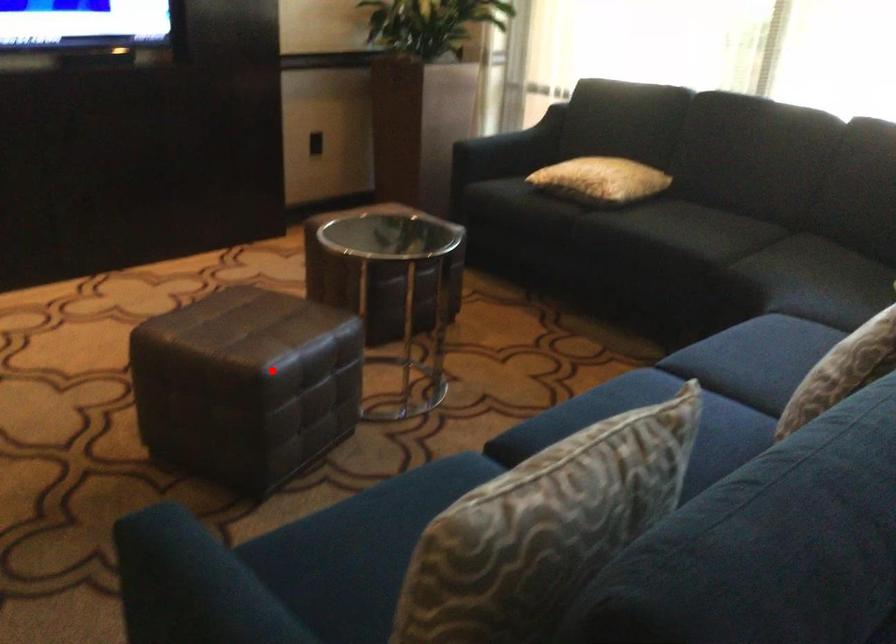
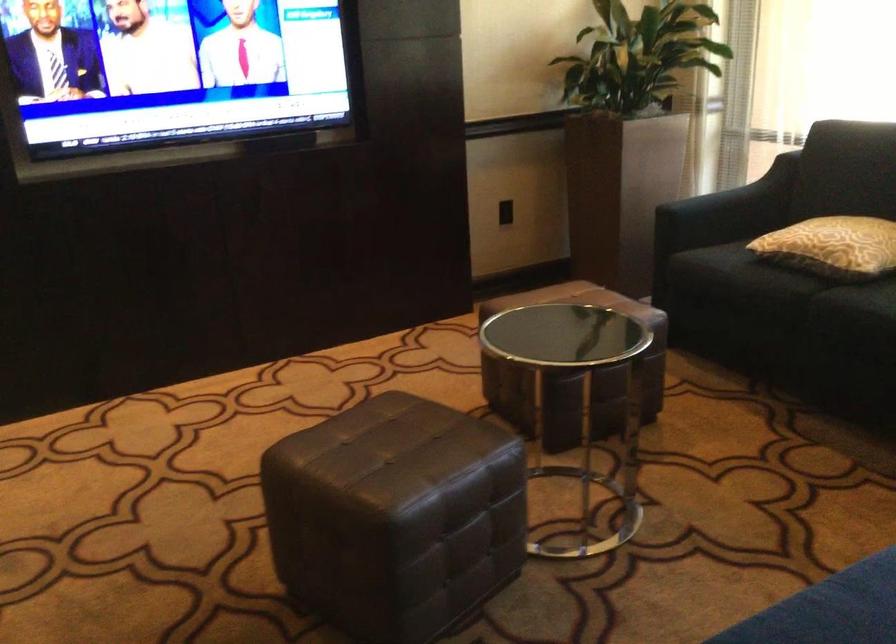
Question: I am providing you with two images of the same scene from different viewpoints. A red point is shown in image1. For the corresponding object point in image2, is it positioned nearer or farther from the camera?

Choices:
 (A) Nearer
 (B) Farther

Answer: (A)